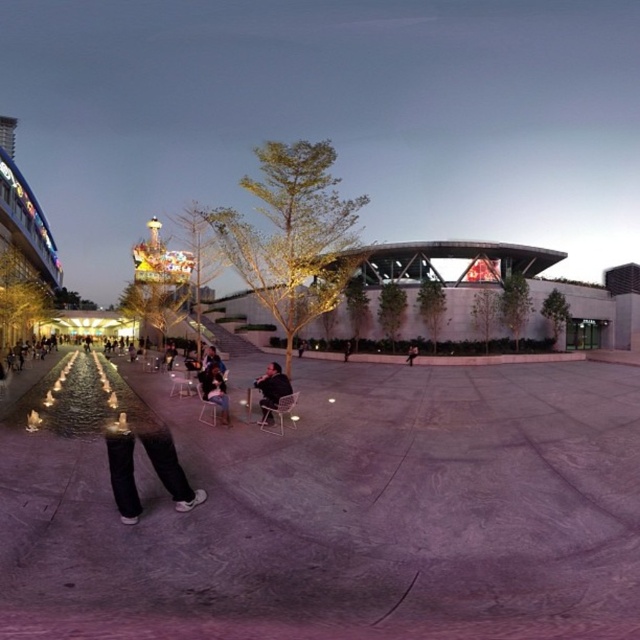
Is the position of dark gray fabric jacket at center less distant than that of dark blue jeans at center?

No, it is not.

Is point (278, 365) closer to viewer compared to point (198, 376)?

No, (278, 365) is further to viewer.

Is point (268, 385) behind point (212, 401)?

Yes.

At what (x,y) coordinates should I click in order to perform the action: click on dark gray fabric jacket at center. Please return your answer as a coordinate pair (x, y). The height and width of the screenshot is (640, 640). Looking at the image, I should click on (272, 388).

Who is more forward, (x=256, y=630) or (x=412, y=348)?

Point (x=256, y=630) is in front.

Is point (228, 632) less distant than point (410, 349)?

Yes, point (228, 632) is closer to viewer.

Who is more forward, (518,531) or (416,352)?

Point (518,531) is in front.

This screenshot has height=640, width=640. What are the coordinates of `concrete skate park at center` in the screenshot? It's located at (333, 509).

Does dark blue jeans at center appear under dark gray pants at center?

No, dark blue jeans at center is not below dark gray pants at center.

Measure the distance from dark blue jeans at center to dark gray pants at center.

The distance of dark blue jeans at center from dark gray pants at center is 12.43 meters.

Does point (211, 394) come behind point (412, 360)?

No, it is in front of (412, 360).

In order to click on dark blue jeans at center in this screenshot , I will do `click(214, 388)`.